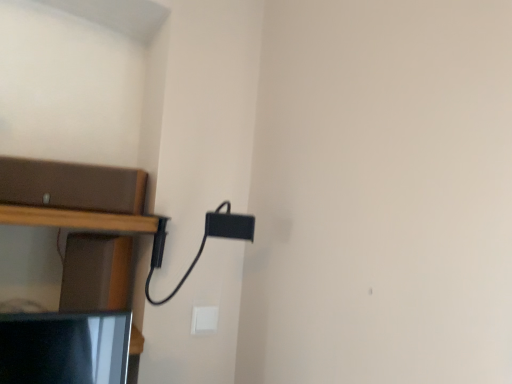
Question: From a real-world perspective, is brown matte shelf at left located beneath white plastic light switch at lower center?

Choices:
 (A) yes
 (B) no

Answer: (B)

Question: Considering the relative sizes of brown matte shelf at left and white plastic light switch at lower center in the image provided, is brown matte shelf at left thinner than white plastic light switch at lower center?

Choices:
 (A) no
 (B) yes

Answer: (A)

Question: Does brown matte shelf at left turn towards white plastic light switch at lower center?

Choices:
 (A) yes
 (B) no

Answer: (B)

Question: Does brown matte shelf at left have a greater width compared to white plastic light switch at lower center?

Choices:
 (A) no
 (B) yes

Answer: (B)

Question: From the image's perspective, is brown matte shelf at left above white plastic light switch at lower center?

Choices:
 (A) yes
 (B) no

Answer: (A)

Question: Does brown matte shelf at left appear on the right side of white plastic light switch at lower center?

Choices:
 (A) yes
 (B) no

Answer: (B)

Question: Does white plastic light switch at lower center turn towards brown matte shelf at left?

Choices:
 (A) no
 (B) yes

Answer: (A)

Question: Is white plastic light switch at lower center bigger than brown matte shelf at left?

Choices:
 (A) no
 (B) yes

Answer: (A)

Question: Is white plastic light switch at lower center smaller than brown matte shelf at left?

Choices:
 (A) yes
 (B) no

Answer: (A)

Question: Considering the relative sizes of white plastic light switch at lower center and brown matte shelf at left in the image provided, is white plastic light switch at lower center shorter than brown matte shelf at left?

Choices:
 (A) no
 (B) yes

Answer: (B)

Question: Can you confirm if white plastic light switch at lower center is wider than brown matte shelf at left?

Choices:
 (A) no
 (B) yes

Answer: (A)

Question: From a real-world perspective, is white plastic light switch at lower center physically above brown matte shelf at left?

Choices:
 (A) yes
 (B) no

Answer: (B)

Question: Is brown matte shelf at left taller or shorter than white plastic light switch at lower center?

Choices:
 (A) tall
 (B) short

Answer: (A)